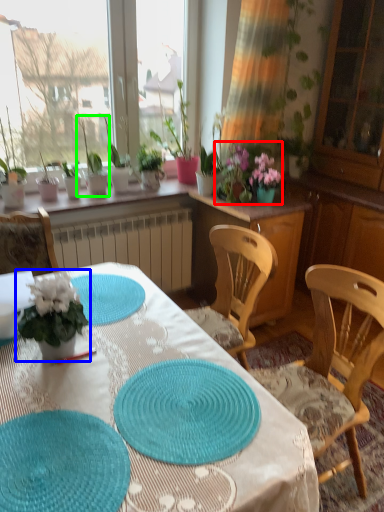
Question: Which object is the closest to the floral arrangement (highlighted by a red box)? Choose among these: houseplant (highlighted by a blue box) or houseplant (highlighted by a green box).

Choices:
 (A) houseplant
 (B) houseplant

Answer: (B)